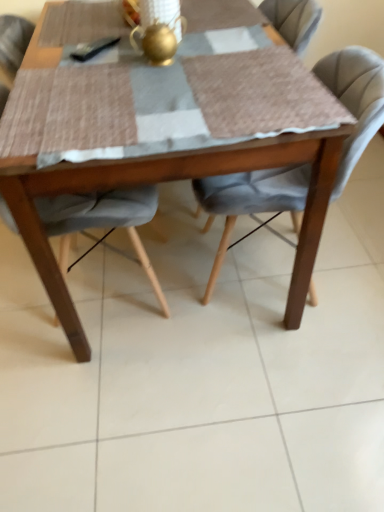
Question: Considering the relative positions of wooden table at center and velvet grey chair at center, positioned as the first chair in right-to-left order, in the image provided, is wooden table at center behind velvet grey chair at center, positioned as the first chair in right-to-left order,?

Choices:
 (A) no
 (B) yes

Answer: (A)

Question: Is wooden table at center far away from velvet grey chair at center, positioned as the first chair in right-to-left order?

Choices:
 (A) no
 (B) yes

Answer: (A)

Question: Could you tell me if wooden table at center is facing velvet grey chair at center, positioned as the first chair in right-to-left order?

Choices:
 (A) yes
 (B) no

Answer: (B)

Question: From a real-world perspective, is wooden table at center over velvet grey chair at center, positioned as the second chair in left-to-right order?

Choices:
 (A) no
 (B) yes

Answer: (B)

Question: Considering the relative sizes of wooden table at center and velvet grey chair at center, positioned as the first chair in right-to-left order, in the image provided, is wooden table at center smaller than velvet grey chair at center, positioned as the first chair in right-to-left order,?

Choices:
 (A) yes
 (B) no

Answer: (B)

Question: Is wooden table at center outside of velvet grey chair at center, positioned as the second chair in left-to-right order?

Choices:
 (A) yes
 (B) no

Answer: (A)

Question: From a real-world perspective, is velvet grey chair at center, positioned as the second chair in left-to-right order, on velvet grey chair at center, which ranks as the second chair in right-to-left order?

Choices:
 (A) yes
 (B) no

Answer: (B)

Question: Does velvet grey chair at center, positioned as the first chair in right-to-left order, have a lesser width compared to velvet grey chair at center, marked as the first chair in a left-to-right arrangement?

Choices:
 (A) yes
 (B) no

Answer: (B)

Question: Is velvet grey chair at center, positioned as the second chair in left-to-right order, surrounding velvet grey chair at center, which ranks as the second chair in right-to-left order?

Choices:
 (A) yes
 (B) no

Answer: (B)

Question: Is velvet grey chair at center, positioned as the second chair in left-to-right order, facing towards velvet grey chair at center, marked as the first chair in a left-to-right arrangement?

Choices:
 (A) no
 (B) yes

Answer: (B)

Question: Does velvet grey chair at center, positioned as the second chair in left-to-right order, come behind velvet grey chair at center, which ranks as the second chair in right-to-left order?

Choices:
 (A) no
 (B) yes

Answer: (B)

Question: Does velvet grey chair at center, positioned as the first chair in right-to-left order, have a smaller size compared to velvet grey chair at center, marked as the first chair in a left-to-right arrangement?

Choices:
 (A) no
 (B) yes

Answer: (B)

Question: Is velvet grey chair at center, positioned as the first chair in right-to-left order, wider than gold metallic teapot at center?

Choices:
 (A) no
 (B) yes

Answer: (B)